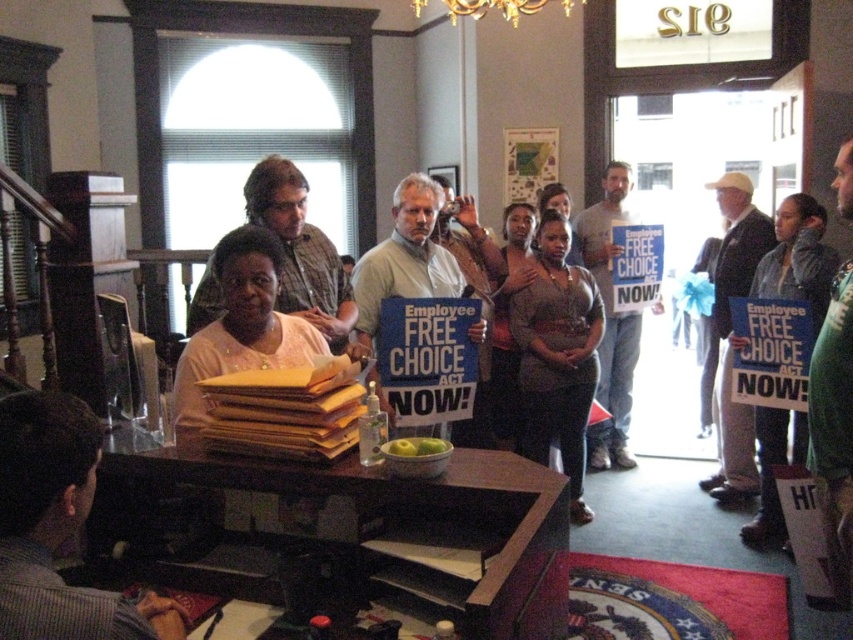
You are a photographer trying to capture a closeup of the pink fabric shirt at center and the light brown suit at center. Since you want to focus on the smaller one, which one should you adjust your camera settings for?

The pink fabric shirt at center is smaller than the light brown suit at center, so you should adjust your camera settings to focus on the pink fabric shirt at center.

You are a photographer trying to capture a clear shot of both the matte brown shirt at center and the green fabric jacket at center. Since you want both to be fully visible in the frame, which clothing item should you focus on first to ensure the taller one is properly framed?

The matte brown shirt at center is taller than the green fabric jacket at center. Therefore, you should focus on framing the matte brown shirt at center first to ensure its full height is captured, as it is the taller of the two.